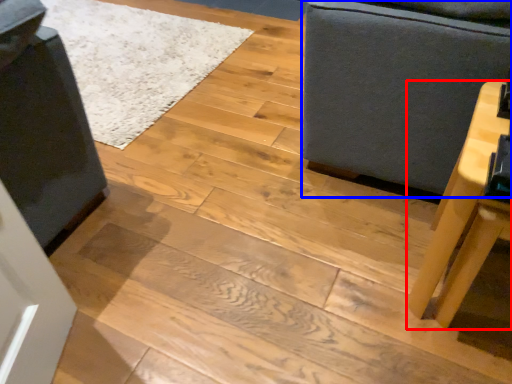
Question: Which object appears farthest to the camera in this image, table (highlighted by a red box) or furniture (highlighted by a blue box)?

Choices:
 (A) table
 (B) furniture

Answer: (B)